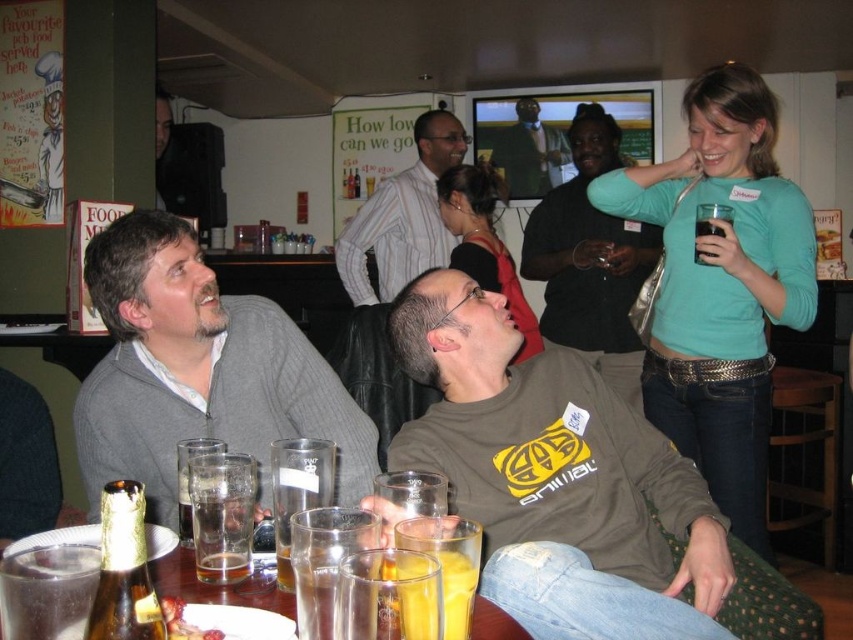
Can you confirm if translucent glass at table left is wider than yellow translucent glass at lower center?

Indeed, translucent glass at table left has a greater width compared to yellow translucent glass at lower center.

Between translucent glass at table left and yellow translucent glass at lower center, which one has more height?

Standing taller between the two is translucent glass at table left.

What do you see at coordinates (222, 515) in the screenshot?
I see `translucent glass at table left` at bounding box center [222, 515].

Where is `translucent glass at table left`? translucent glass at table left is located at coordinates (222, 515).

Who is positioned more to the left, gold foil beer bottle at lower left or translucent glass at table left?

Positioned to the left is translucent glass at table left.

Who is more forward, (x=144, y=548) or (x=231, y=454)?

Point (x=144, y=548) is in front.

Between point (129, 486) and point (224, 458), which one is positioned in front?

Positioned in front is point (129, 486).

At what (x,y) coordinates should I click in order to perform the action: click on gold foil beer bottle at lower left. Please return your answer as a coordinate pair (x, y). Image resolution: width=853 pixels, height=640 pixels. Looking at the image, I should click on (x=125, y=570).

Can you confirm if teal jersey at upper right is positioned below gray sweater at left?

No.

In the scene shown: Which is above, teal jersey at upper right or gray sweater at left?

teal jersey at upper right is higher up.

The height and width of the screenshot is (640, 853). Describe the element at coordinates (721, 285) in the screenshot. I see `teal jersey at upper right` at that location.

At what (x,y) coordinates should I click in order to perform the action: click on teal jersey at upper right. Please return your answer as a coordinate pair (x, y). This screenshot has height=640, width=853. Looking at the image, I should click on 721,285.